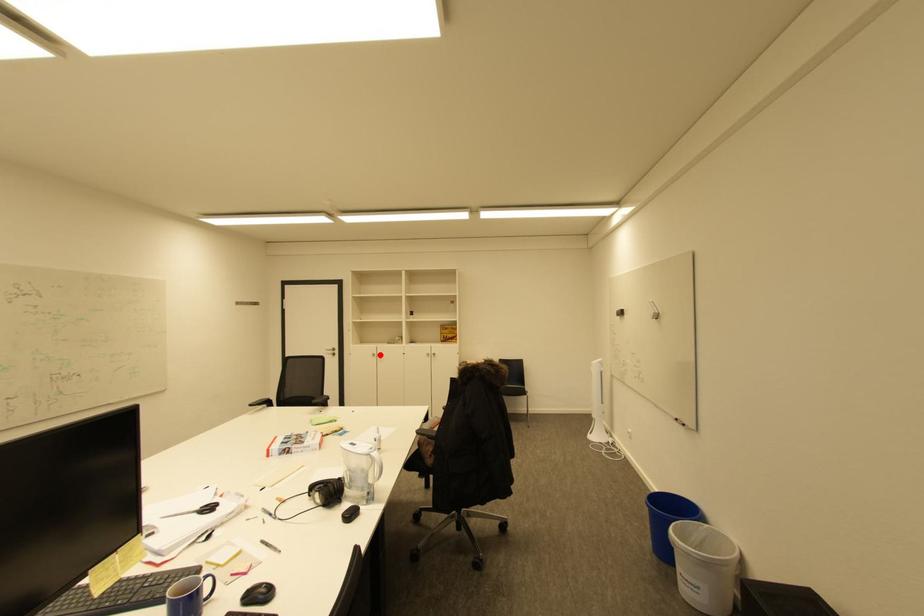
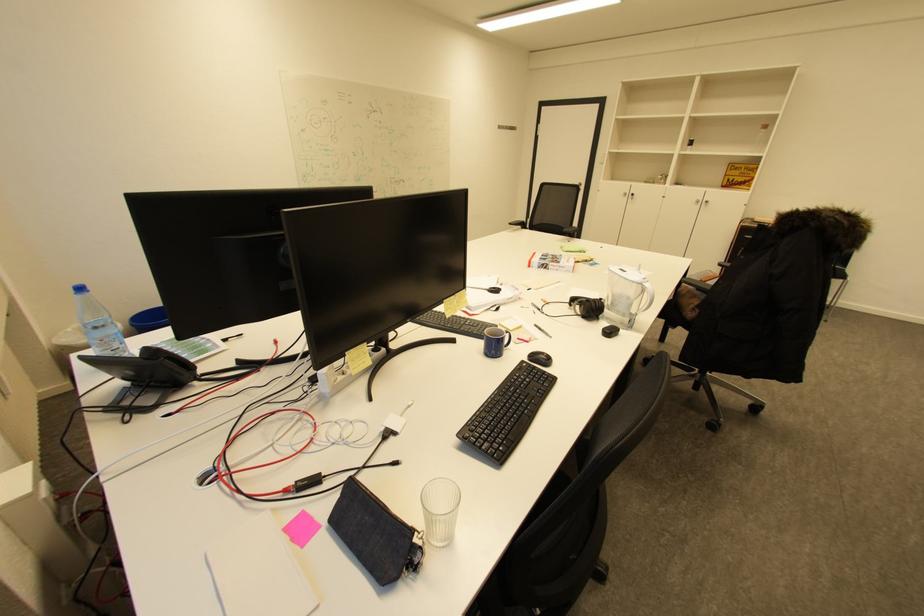
Question: I am providing you with two images of the same scene from different viewpoints. In image1, a red point is highlighted. Considering the same 3D point in image2, which of the following is correct?

Choices:
 (A) It is closer
 (B) It is farther

Answer: (A)